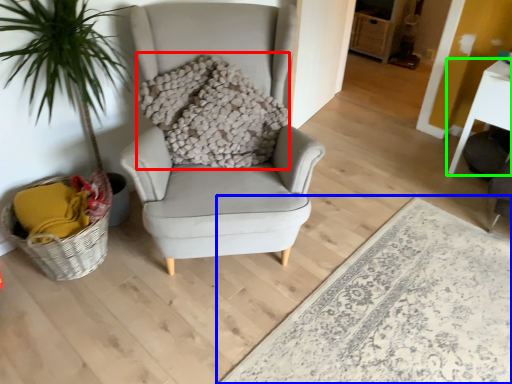
Question: Based on their relative distances, which object is farther from pillow (highlighted by a red box)? Choose from plain (highlighted by a blue box) and table (highlighted by a green box).

Choices:
 (A) plain
 (B) table

Answer: (B)